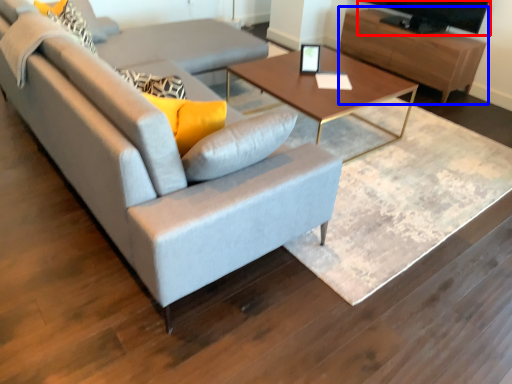
Question: Which object is further to the camera taking this photo, television (highlighted by a red box) or entertainment center (highlighted by a blue box)?

Choices:
 (A) television
 (B) entertainment center

Answer: (B)